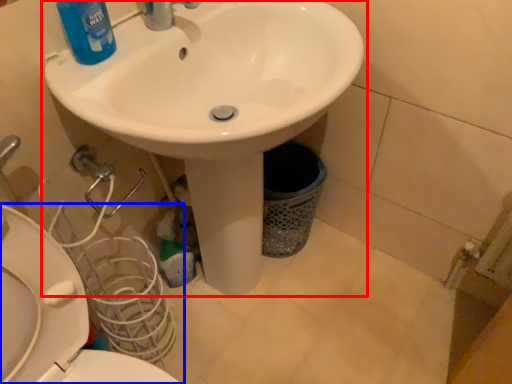
Question: Among these objects, which one is farthest to the camera, sink (highlighted by a red box) or toilet (highlighted by a blue box)?

Choices:
 (A) sink
 (B) toilet

Answer: (B)